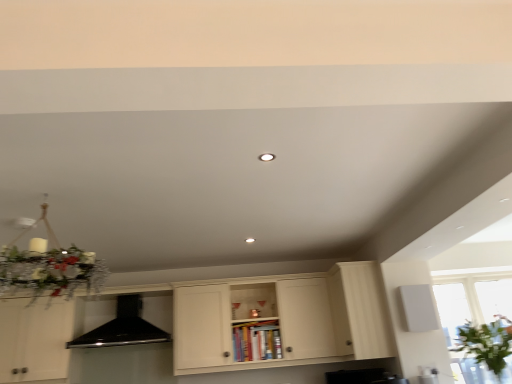
Question: Is white wood cabinet at right, positioned as the first cabinetry in right-to-left order, shorter than transparent glass window at lower right?

Choices:
 (A) yes
 (B) no

Answer: (B)

Question: Is white wood cabinet at right, the second cabinetry positioned from the left, not within transparent glass window at lower right?

Choices:
 (A) yes
 (B) no

Answer: (A)

Question: Is transparent glass window at lower right located within white wood cabinet at right, the second cabinetry positioned from the left?

Choices:
 (A) yes
 (B) no

Answer: (B)

Question: From a real-world perspective, is white wood cabinet at right, positioned as the first cabinetry in right-to-left order, under transparent glass window at lower right?

Choices:
 (A) no
 (B) yes

Answer: (A)

Question: Is white wood cabinet at right, positioned as the first cabinetry in right-to-left order, far from transparent glass window at lower right?

Choices:
 (A) yes
 (B) no

Answer: (B)

Question: Does white wood cabinet at right, positioned as the first cabinetry in right-to-left order, come in front of transparent glass window at lower right?

Choices:
 (A) yes
 (B) no

Answer: (B)

Question: Is transparent glass window at lower right with black matte exhaust hood at center?

Choices:
 (A) no
 (B) yes

Answer: (A)

Question: Is transparent glass window at lower right not close to black matte exhaust hood at center?

Choices:
 (A) yes
 (B) no

Answer: (A)

Question: Can you confirm if transparent glass window at lower right is bigger than black matte exhaust hood at center?

Choices:
 (A) no
 (B) yes

Answer: (A)

Question: Does transparent glass window at lower right lie in front of black matte exhaust hood at center?

Choices:
 (A) no
 (B) yes

Answer: (B)

Question: Is black matte exhaust hood at center surrounded by transparent glass window at lower right?

Choices:
 (A) no
 (B) yes

Answer: (A)

Question: From the image's perspective, is transparent glass window at lower right on top of black matte exhaust hood at center?

Choices:
 (A) no
 (B) yes

Answer: (B)

Question: Is white wood cabinet at right, the second cabinetry positioned from the left, further to camera compared to matte white cabinet at center, positioned as the 1th cabinetry in left-to-right order?

Choices:
 (A) no
 (B) yes

Answer: (B)